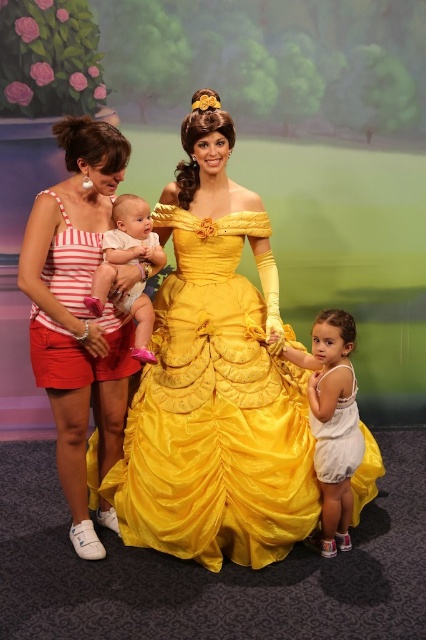
Question: Based on their relative distances, which object is nearer to the striped fabric tank top at left?

Choices:
 (A) white cotton dress at lower right
 (B) white cotton onesie at center
 (C) striped cotton tank top at left

Answer: (C)

Question: Can you confirm if matte yellow dress at center is smaller than white cotton dress at lower right?

Choices:
 (A) no
 (B) yes

Answer: (A)

Question: Which point is closer to the camera?

Choices:
 (A) (135, 269)
 (B) (189, 429)
 (C) (37, 324)
 (D) (88, 298)

Answer: (D)

Question: Can you confirm if striped cotton tank top at left is positioned below striped fabric tank top at left?

Choices:
 (A) yes
 (B) no

Answer: (A)

Question: Which point is farther to the camera?

Choices:
 (A) white cotton onesie at center
 (B) striped cotton tank top at left
 (C) matte yellow dress at center

Answer: (C)

Question: Considering the relative positions of striped fabric tank top at left and white cotton dress at lower right in the image provided, where is striped fabric tank top at left located with respect to white cotton dress at lower right?

Choices:
 (A) above
 (B) below

Answer: (A)